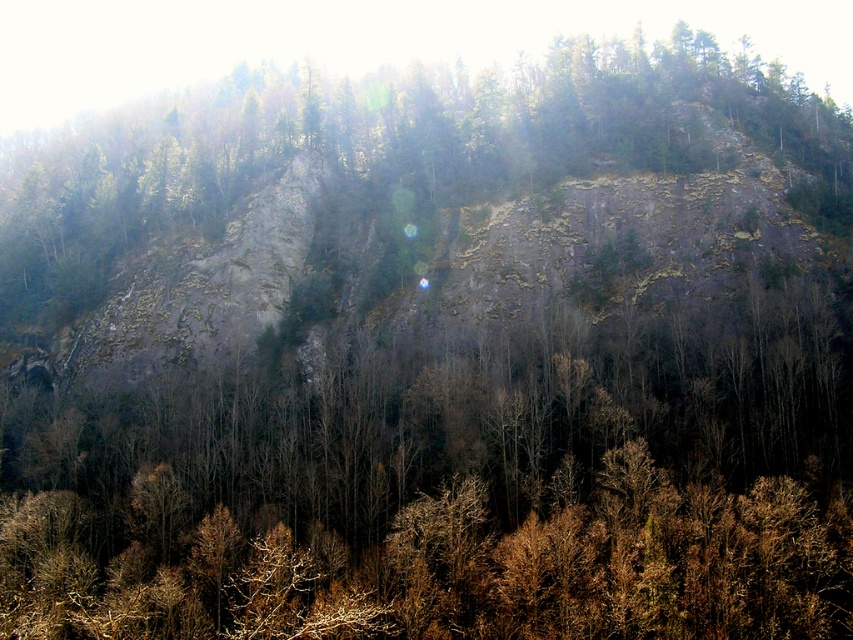
You are planning to place a small wooden bench between the dark brown bark tree at center and the green rough rock at upper center. Which object should the bench be closer to if it needs to be placed near the narrower object?

The bench should be placed closer to the dark brown bark tree at center because its width is less than the green rough rock at upper center.

You are a hiker trying to navigate the steep hillside. You see a dark brown bark tree at center and a green rough rock at upper center. Which object is positioned more to the left?

The green rough rock at upper center is positioned more to the left than the dark brown bark tree at center.